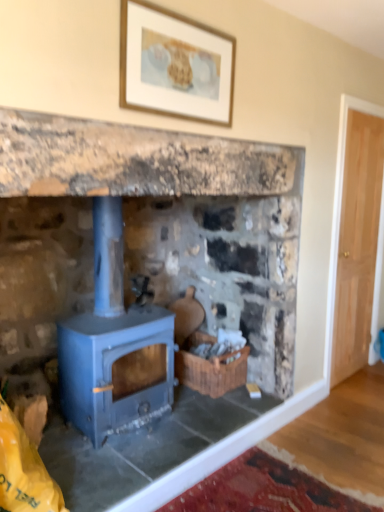
What are the coordinates of `unoccupied area in front of woven brown basket at center` in the screenshot? It's located at pyautogui.click(x=212, y=406).